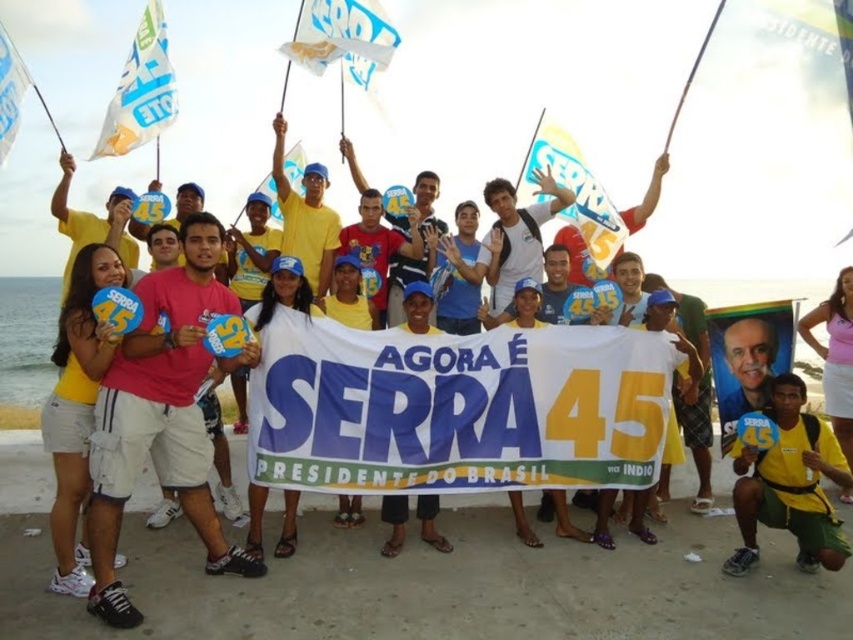
You are a photographer at the rally trying to capture a clear shot of the pink fabric shirt at center and the white paper flag at upper left. Which object is closer to the camera based on their positions?

The white paper flag at upper left is closer to the camera because it is positioned above the pink fabric shirt at center, indicating it is in a higher plane relative to the camera perspective.